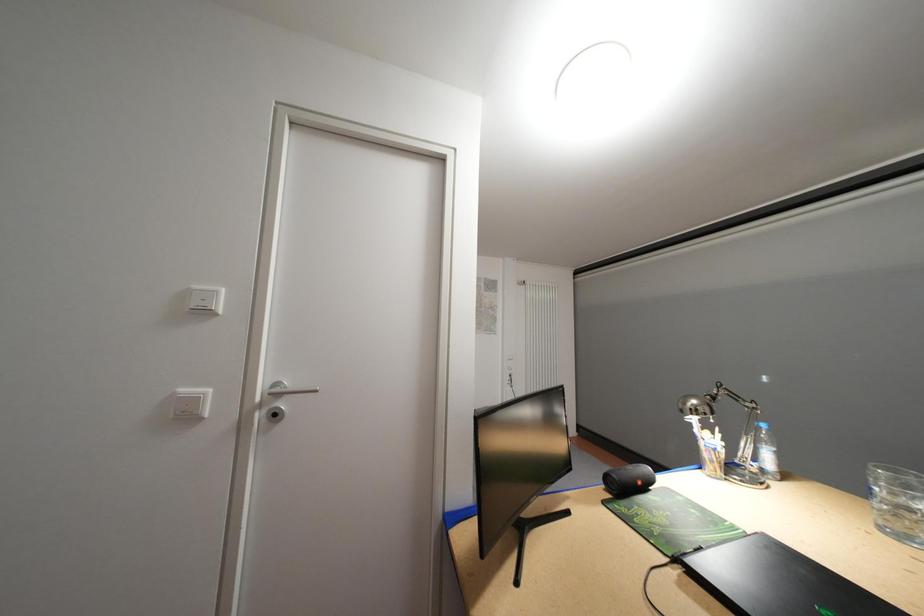
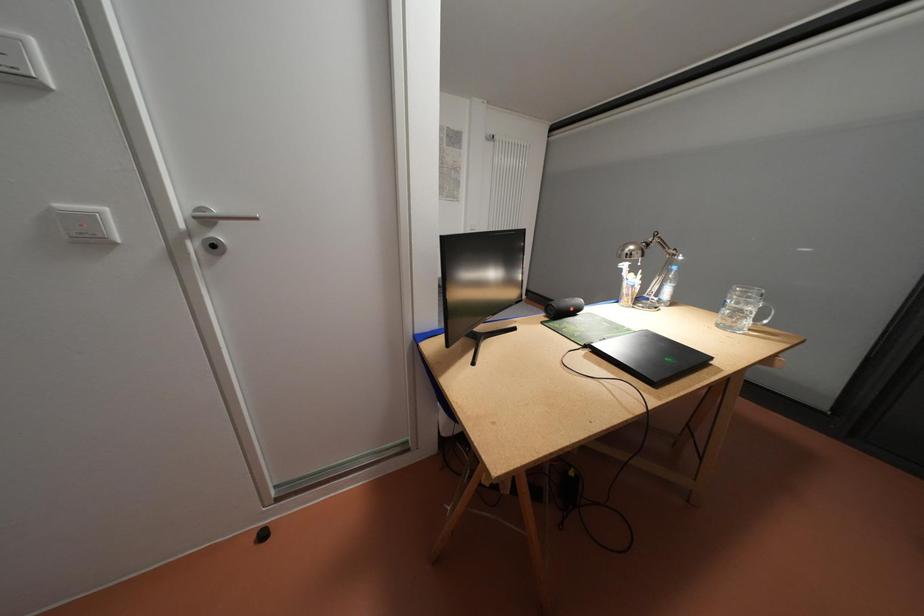
Question: Based on the continuous images, in which direction is the camera rotating? Reply with the corresponding letter.

Choices:
 (A) Left
 (B) Right
 (C) Up
 (D) Down

Answer: (D)